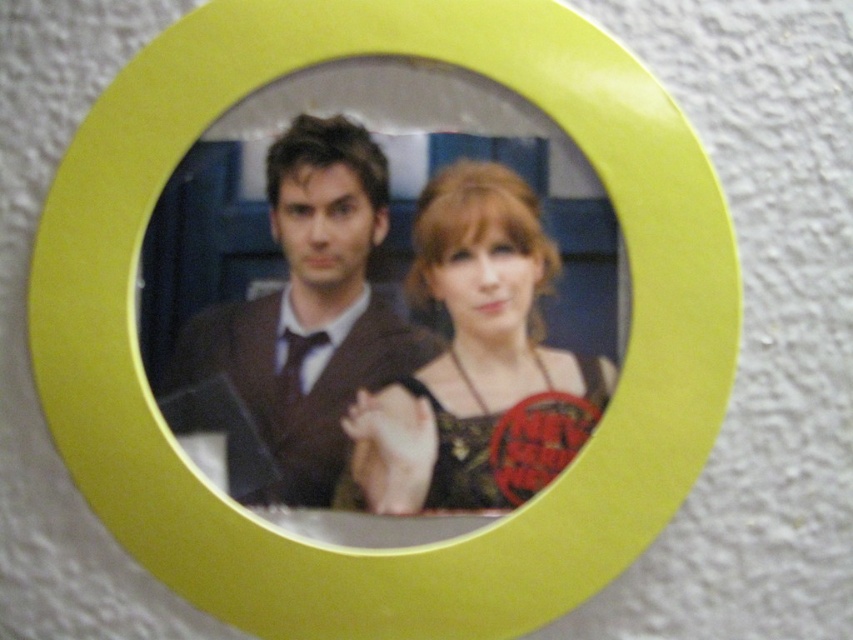
Question: Among these objects, which one is farthest from the camera?

Choices:
 (A) matte black dress at center
 (B) matte brown suit at center

Answer: (B)

Question: Among these objects, which one is nearest to the camera?

Choices:
 (A) matte black dress at center
 (B) matte brown suit at center

Answer: (A)

Question: Does matte black dress at center come in front of matte brown suit at center?

Choices:
 (A) yes
 (B) no

Answer: (A)

Question: Is matte black dress at center to the left of matte brown suit at center from the viewer's perspective?

Choices:
 (A) yes
 (B) no

Answer: (B)

Question: Is the position of matte black dress at center more distant than that of matte brown suit at center?

Choices:
 (A) no
 (B) yes

Answer: (A)